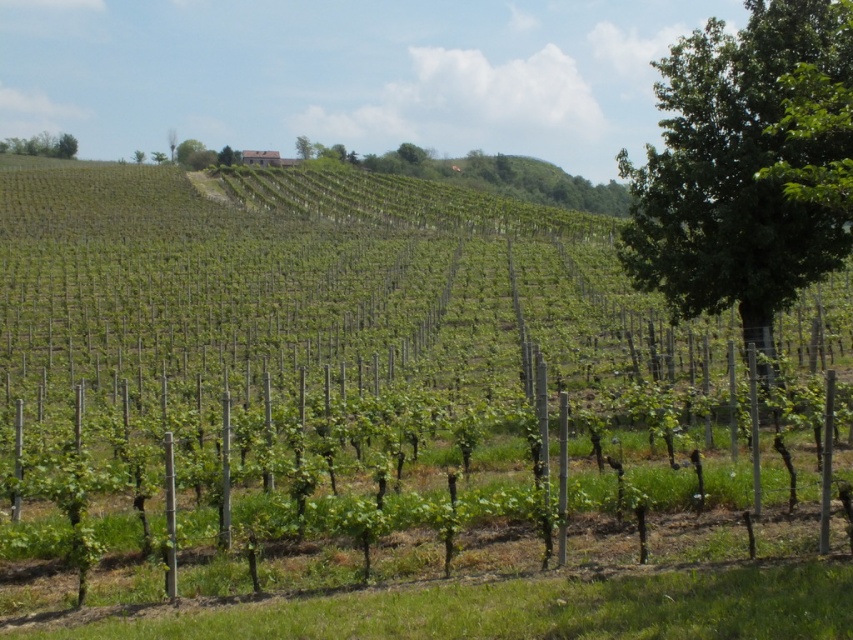
Can you confirm if green leafy tree at right is positioned to the right of green leafy tree at upper left?

Indeed, green leafy tree at right is positioned on the right side of green leafy tree at upper left.

Does green leafy tree at right appear over green leafy tree at upper left?

Actually, green leafy tree at right is below green leafy tree at upper left.

Between point (782, 8) and point (4, 150), which one is positioned in front?

Point (782, 8) is more forward.

Where is `green leafy tree at right`? This screenshot has height=640, width=853. green leafy tree at right is located at coordinates (735, 172).

Which of these two, green leafy tree at right or green leafy tree at upper center, stands shorter?

Standing shorter between the two is green leafy tree at upper center.

Does point (744, 99) come in front of point (296, 136)?

Yes, point (744, 99) is closer to viewer.

Between point (688, 150) and point (306, 148), which one is positioned behind?

Positioned behind is point (306, 148).

Identify the location of green leafy tree at right. This screenshot has height=640, width=853. (735, 172).

Who is more forward, (35, 138) or (306, 141)?

Point (306, 141) is in front.

Between point (54, 134) and point (305, 138), which one is positioned behind?

The point (54, 134) is behind.

Locate an element on the screen. Image resolution: width=853 pixels, height=640 pixels. green leafy tree at upper left is located at coordinates (41, 145).